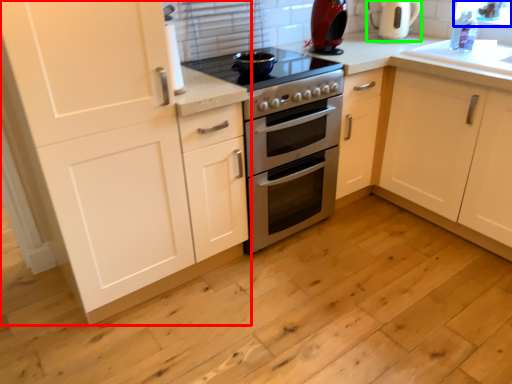
Question: Considering the real-world distances, which object is farthest from cabinetry (highlighted by a red box)? window screen (highlighted by a blue box) or coffeepot (highlighted by a green box)?

Choices:
 (A) window screen
 (B) coffeepot

Answer: (A)